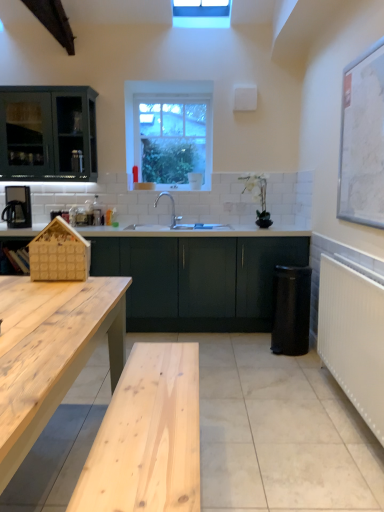
You are a GUI agent. You are given a task and a screenshot of the screen. Output one action in this format:
    pyautogui.click(x=<x>, y=<y>)
    Task: Click on the blank space to the left of wooden house at left
    The image size is (384, 512).
    Given the screenshot: What is the action you would take?
    pyautogui.click(x=23, y=281)